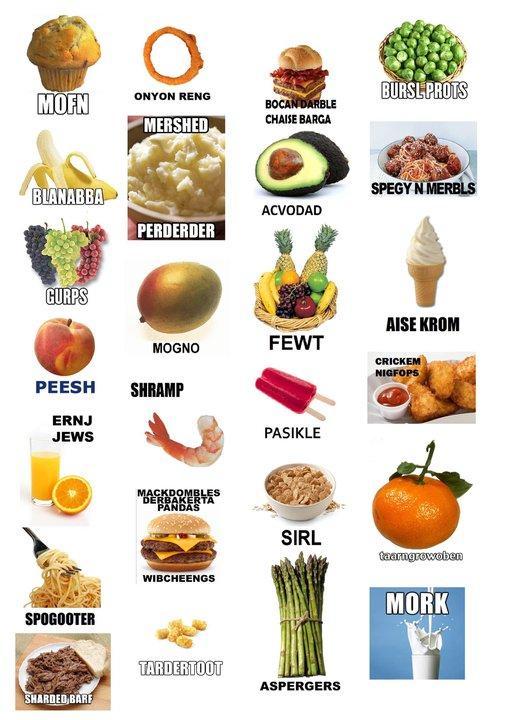
The image size is (505, 720). I want to click on fruit basket, so click(298, 323).